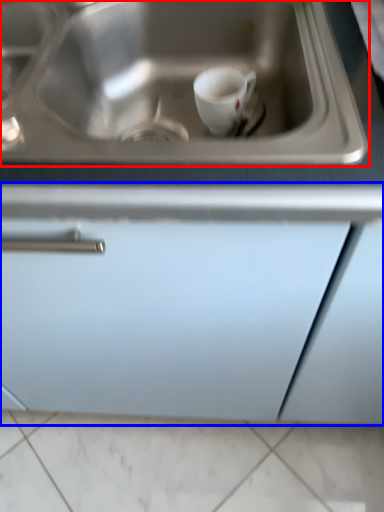
Question: Which of the following is the closest to the observer, sink (highlighted by a red box) or cabinetry (highlighted by a blue box)?

Choices:
 (A) sink
 (B) cabinetry

Answer: (B)